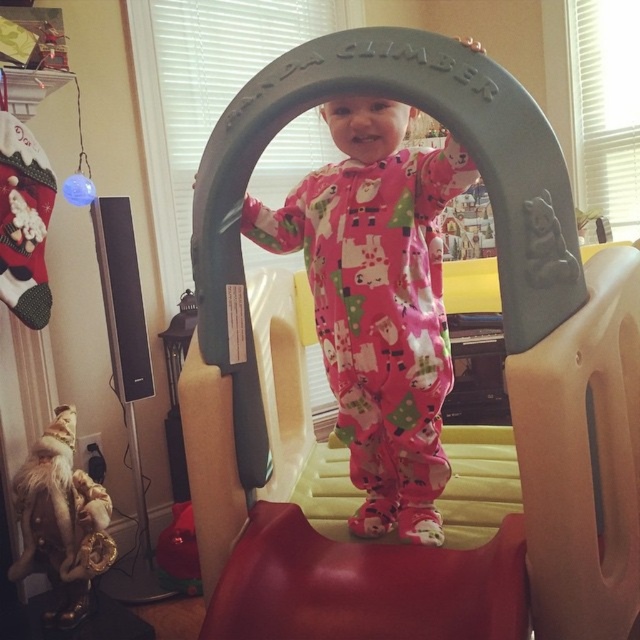
Is plastic at center positioned at the back of fuzzy fabric plush at lower left?

That is False.

What do you see at coordinates (506, 378) in the screenshot? The height and width of the screenshot is (640, 640). I see `plastic at center` at bounding box center [506, 378].

The image size is (640, 640). Identify the location of plastic at center. tap(506, 378).

Can you confirm if plastic at center is positioned to the right of pink cotton onesie at center?

Correct, you'll find plastic at center to the right of pink cotton onesie at center.

Who is more forward, (x=298, y=624) or (x=429, y=452)?

Point (x=298, y=624)

This screenshot has height=640, width=640. In order to click on plastic at center in this screenshot , I will do `click(506, 378)`.

Does pink cotton onesie at center appear over fuzzy fabric plush at lower left?

Yes, pink cotton onesie at center is above fuzzy fabric plush at lower left.

Looking at this image, which is above, pink cotton onesie at center or fuzzy fabric plush at lower left?

pink cotton onesie at center is above.

Does point (356, 374) lie in front of point (52, 436)?

Yes, point (356, 374) is in front of point (52, 436).

Find the location of a particular element. pink cotton onesie at center is located at coordinates (378, 314).